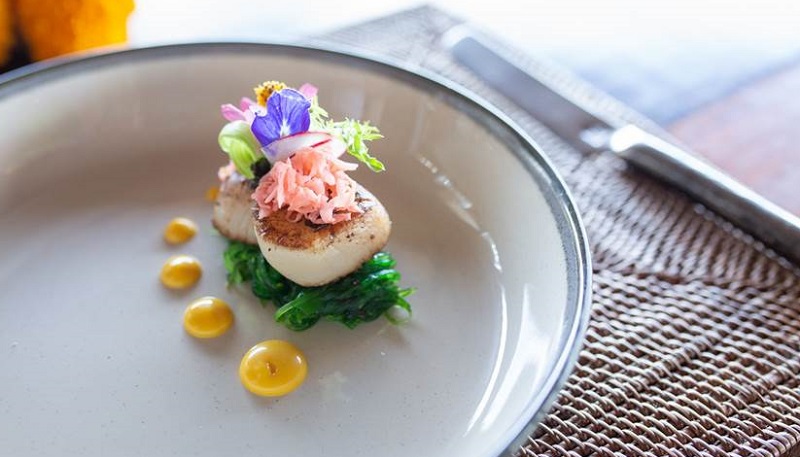
Identify the location of silverware. Image resolution: width=800 pixels, height=457 pixels. (658, 156).